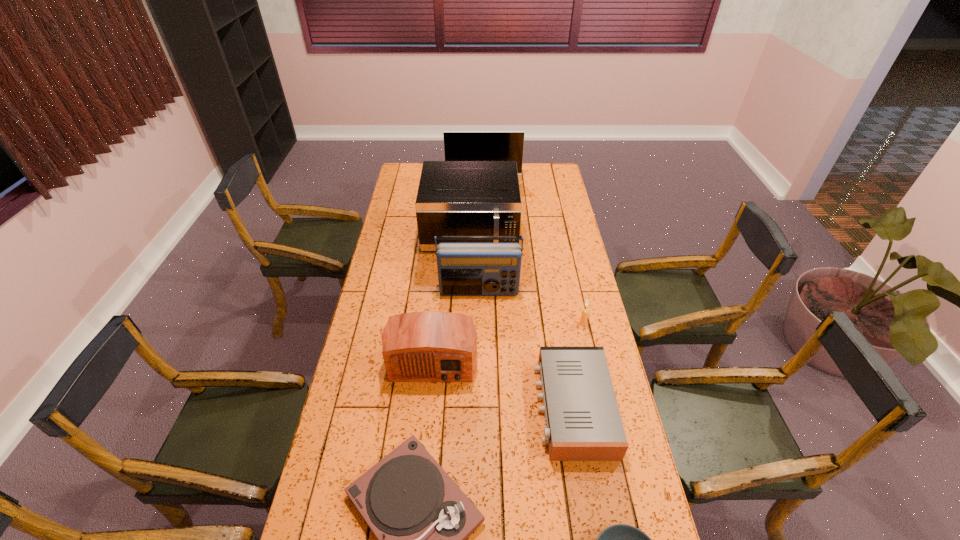
The height and width of the screenshot is (540, 960). Identify the location of vacant space located 0.060m on the front panel of the third farthest object. (479, 311).

Image resolution: width=960 pixels, height=540 pixels. What are the coordinates of `free space located on the front-facing side of the second farthest object` in the screenshot? It's located at (468, 286).

Locate an element on the screen. Image resolution: width=960 pixels, height=540 pixels. free space located 0.240m on the front-facing side of the second tallest radio receiver is located at coordinates (423, 461).

Identify the location of blank space located 0.210m on the back of the fifth nearest object. (574, 282).

Locate an element on the screen. This screenshot has width=960, height=540. free space located on the control panel of the third shortest object is located at coordinates (455, 407).

I want to click on vacant space situated 0.240m on the control panel of the third shortest object, so click(461, 407).

I want to click on vacant space located 0.380m on the control panel of the third shortest object, so click(x=417, y=407).

Where is `object at the far edge`? object at the far edge is located at coordinates point(458,145).

Locate an element on the screen. The height and width of the screenshot is (540, 960). object at the left edge is located at coordinates (430, 346).

At what (x,y) coordinates should I click in order to perform the action: click on candle that is at the right edge. Please return your answer as a coordinate pair (x, y). Looking at the image, I should click on (583, 321).